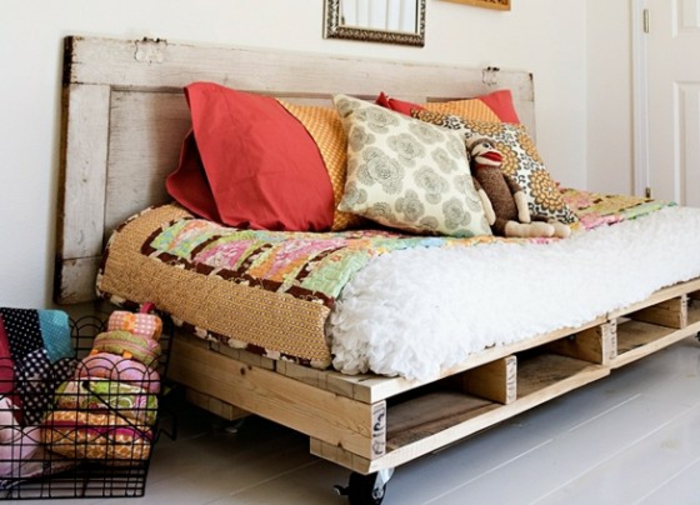
Where is `white fur blanket`? The height and width of the screenshot is (505, 700). white fur blanket is located at coordinates (592, 260).